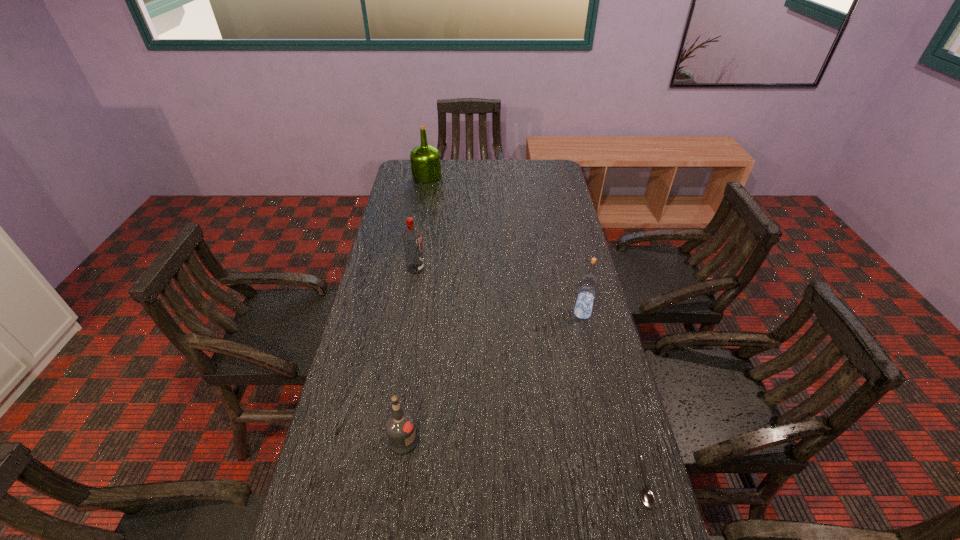
At what (x,y) coordinates should I click in order to perform the action: click on the farthest object. Please return your answer as a coordinate pair (x, y). This screenshot has width=960, height=540. Looking at the image, I should click on (x=425, y=159).

The height and width of the screenshot is (540, 960). What are the coordinates of `the second object from right to left` in the screenshot? It's located at coord(588,284).

I want to click on the third nearest object, so click(x=588, y=284).

Identify the location of the fourth nearest object. This screenshot has height=540, width=960. (411, 237).

At what (x,y) coordinates should I click in order to perform the action: click on the nearest vodka. Please return your answer as a coordinate pair (x, y). Image resolution: width=960 pixels, height=540 pixels. Looking at the image, I should click on (400, 427).

Locate an element on the screen. This screenshot has width=960, height=540. the nearest object is located at coordinates (647, 498).

The image size is (960, 540). I want to click on soupspoon, so click(x=647, y=498).

This screenshot has height=540, width=960. In order to click on free space located 0.370m on the right of the olive oil in this screenshot , I will do `click(521, 176)`.

Where is `free space located 0.360m on the left of the second object from right to left`? free space located 0.360m on the left of the second object from right to left is located at coordinates (460, 313).

Locate an element on the screen. The width and height of the screenshot is (960, 540). free space located 0.220m on the front label of the fourth nearest object is located at coordinates (488, 269).